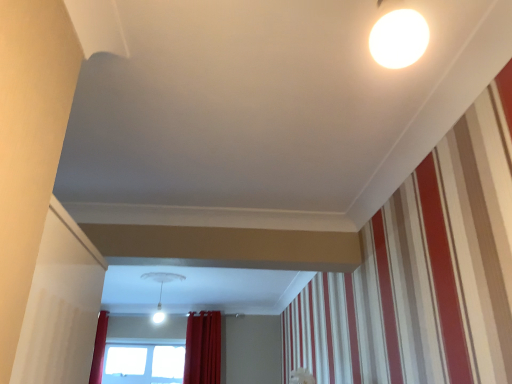
Question: From the image's perspective, is red velvet curtain at lower center beneath white glossy light fixture at center?

Choices:
 (A) yes
 (B) no

Answer: (A)

Question: From a real-world perspective, is red velvet curtain at lower center under white glossy light fixture at center?

Choices:
 (A) yes
 (B) no

Answer: (A)

Question: From a real-world perspective, is red velvet curtain at lower center located higher than white glossy light fixture at center?

Choices:
 (A) yes
 (B) no

Answer: (B)

Question: From the image's perspective, is red velvet curtain at lower center located above white glossy light fixture at center?

Choices:
 (A) no
 (B) yes

Answer: (A)

Question: Is red velvet curtain at lower center not within white glossy light fixture at center?

Choices:
 (A) yes
 (B) no

Answer: (A)

Question: Considering the relative sizes of red velvet curtain at lower center and white glossy light fixture at center in the image provided, is red velvet curtain at lower center thinner than white glossy light fixture at center?

Choices:
 (A) yes
 (B) no

Answer: (A)

Question: From the image's perspective, is white glossy light fixture at center on top of red velvet curtain at lower center?

Choices:
 (A) yes
 (B) no

Answer: (A)

Question: Considering the relative sizes of white glossy light fixture at center and red velvet curtain at lower center in the image provided, is white glossy light fixture at center smaller than red velvet curtain at lower center?

Choices:
 (A) yes
 (B) no

Answer: (A)

Question: Does white glossy light fixture at center come behind red velvet curtain at lower center?

Choices:
 (A) yes
 (B) no

Answer: (B)

Question: Is white glossy light fixture at center positioned with its back to red velvet curtain at lower center?

Choices:
 (A) yes
 (B) no

Answer: (A)

Question: Could you tell me if white glossy light fixture at center is turned towards red velvet curtain at lower center?

Choices:
 (A) no
 (B) yes

Answer: (A)

Question: Can you confirm if white glossy light fixture at center is taller than red velvet curtain at lower center?

Choices:
 (A) yes
 (B) no

Answer: (B)

Question: Is red velvet curtain at lower center looking in the opposite direction of transparent glass window at lower center?

Choices:
 (A) yes
 (B) no

Answer: (B)